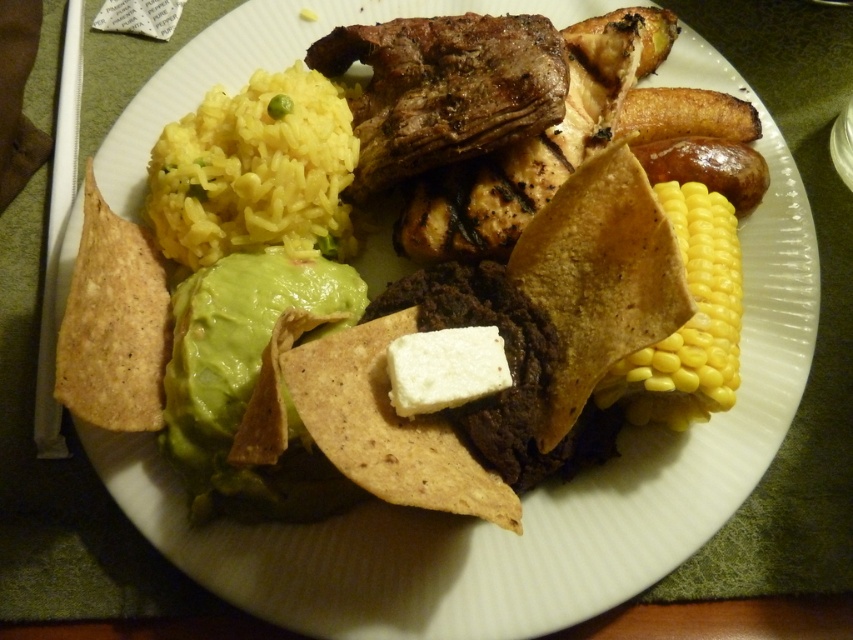
Can you confirm if yellow/yellowish rice at upper left is wider than grilled brown meat at center?

In fact, yellow/yellowish rice at upper left might be narrower than grilled brown meat at center.

Consider the image. Can you confirm if yellow/yellowish rice at upper left is positioned to the right of grilled brown meat at center?

Incorrect, yellow/yellowish rice at upper left is not on the right side of grilled brown meat at center.

Is point (251, 96) closer to viewer compared to point (524, 92)?

No.

Locate an element on the screen. The width and height of the screenshot is (853, 640). yellow/yellowish rice at upper left is located at coordinates (254, 172).

Image resolution: width=853 pixels, height=640 pixels. Describe the element at coordinates (250, 384) in the screenshot. I see `green creamy guacamole at center` at that location.

Does green creamy guacamole at center appear on the left side of white creamy cheese at center?

Yes, green creamy guacamole at center is to the left of white creamy cheese at center.

At what (x,y) coordinates should I click in order to perform the action: click on green creamy guacamole at center. Please return your answer as a coordinate pair (x, y). This screenshot has width=853, height=640. Looking at the image, I should click on (250, 384).

Does grilled brown meat at center appear under yellow matte corn at right?

Actually, grilled brown meat at center is above yellow matte corn at right.

Who is shorter, grilled brown meat at center or yellow matte corn at right?

grilled brown meat at center is shorter.

Who is more distant from viewer, [436,120] or [714,224]?

The point [436,120] is more distant.

Locate an element on the screen. grilled brown meat at center is located at coordinates (444, 90).